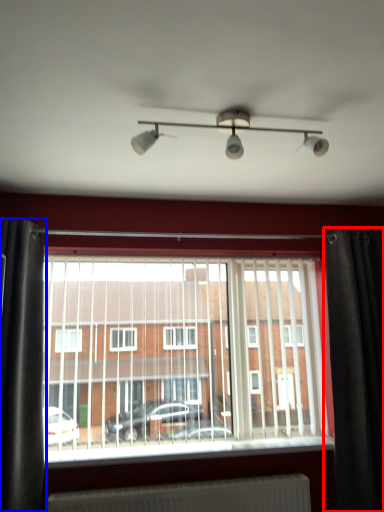
Question: Which point is further to the camera, curtain (highlighted by a red box) or curtain (highlighted by a blue box)?

Choices:
 (A) curtain
 (B) curtain

Answer: (A)